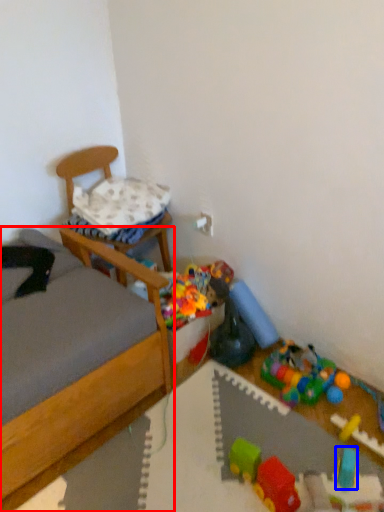
Question: Which object is closer to the camera taking this photo, bed (highlighted by a red box) or toy (highlighted by a blue box)?

Choices:
 (A) bed
 (B) toy

Answer: (A)